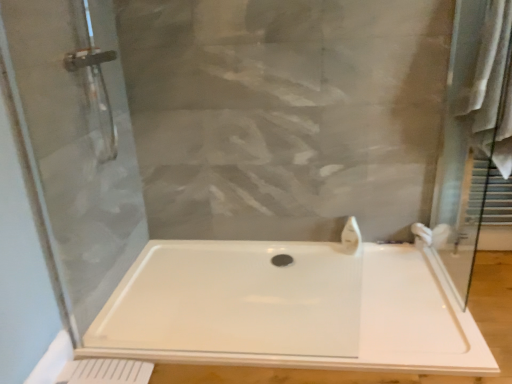
Find the location of `white plastic bathtub at center`. white plastic bathtub at center is located at coordinates (289, 309).

Identify the location of white plastic bathtub at center. (289, 309).

Does point (328, 270) come behind point (497, 142)?

Yes.

Which object is further away from the camera taking this photo, white plastic bathtub at center or white fabric bath towel at right?

white fabric bath towel at right is behind.

How different are the orientations of white plastic bathtub at center and white fabric bath towel at right in degrees?

176 degrees separate the facing orientations of white plastic bathtub at center and white fabric bath towel at right.

From a real-world perspective, who is located higher, white plastic bathtub at center or white fabric bath towel at right?

In real-world perspective, white fabric bath towel at right is above.

From a real-world perspective, is white glossy faucet at upper right under white plastic bathtub at center?

Actually, white glossy faucet at upper right is physically above white plastic bathtub at center in the real world.

Does point (356, 226) come closer to viewer compared to point (329, 317)?

No, it is behind (329, 317).

In the image, is white glossy faucet at upper right positioned in front of or behind white plastic bathtub at center?

Clearly, white glossy faucet at upper right is behind white plastic bathtub at center.

Considering the sizes of white glossy faucet at upper right and white plastic bathtub at center in the image, is white glossy faucet at upper right wider or thinner than white plastic bathtub at center?

In the image, white glossy faucet at upper right appears to be more narrow than white plastic bathtub at center.

Is white plastic bathtub at center far from white glossy faucet at upper right?

No, white plastic bathtub at center is not far away from white glossy faucet at upper right.

What's the angular difference between white plastic bathtub at center and white glossy faucet at upper right's facing directions?

They differ by 159 degrees in their facing directions.

From the image's perspective, is white plastic bathtub at center on top of white glossy faucet at upper right?

No, from the image's perspective, white plastic bathtub at center is not over white glossy faucet at upper right.

Is white plastic bathtub at center spatially inside white glossy faucet at upper right, or outside of it?

white plastic bathtub at center lies outside white glossy faucet at upper right.

Looking at their sizes, would you say white fabric bath towel at right is wider or thinner than white glossy faucet at upper right?

Clearly, white fabric bath towel at right has more width compared to white glossy faucet at upper right.

Can you confirm if white fabric bath towel at right is positioned to the left of white glossy faucet at upper right?

In fact, white fabric bath towel at right is to the right of white glossy faucet at upper right.

From the image's perspective, between white fabric bath towel at right and white glossy faucet at upper right, who is located below?

white glossy faucet at upper right appears lower in the image.

From the picture: From a real-world perspective, is white fabric bath towel at right above or below white glossy faucet at upper right?

From a real-world perspective, white fabric bath towel at right is physically above white glossy faucet at upper right.

The height and width of the screenshot is (384, 512). I want to click on bath towel in front of the white glossy faucet at upper right, so click(490, 89).

Consider the image. Is white glossy faucet at upper right facing towards white fabric bath towel at right?

No, white glossy faucet at upper right is not facing towards white fabric bath towel at right.

Can you confirm if white glossy faucet at upper right is wider than white fabric bath towel at right?

In fact, white glossy faucet at upper right might be narrower than white fabric bath towel at right.

Is white fabric bath towel at right placed right next to white plastic bathtub at center?

There is a gap between white fabric bath towel at right and white plastic bathtub at center.

Is point (492, 125) behind point (249, 258)?

No, (492, 125) is in front of (249, 258).

Is white plastic bathtub at center surrounded by white fabric bath towel at right?

No, white plastic bathtub at center is not surrounded by white fabric bath towel at right.

Image resolution: width=512 pixels, height=384 pixels. I want to click on bath towel above the white plastic bathtub at center (from a real-world perspective), so click(x=490, y=89).

At what (x,y) coordinates should I click in order to perform the action: click on bathtub that appears in front of the white glossy faucet at upper right. Please return your answer as a coordinate pair (x, y). This screenshot has height=384, width=512. Looking at the image, I should click on (289, 309).

Looking at the image, which one is located further to white plastic bathtub at center, white fabric bath towel at right or white glossy faucet at upper right?

white fabric bath towel at right is positioned further to the anchor white plastic bathtub at center.

From the image, which object appears to be nearer to white plastic bathtub at center, white glossy faucet at upper right or white fabric bath towel at right?

white glossy faucet at upper right is positioned closer to the anchor white plastic bathtub at center.

From the image, which object appears to be nearer to white fabric bath towel at right, white plastic bathtub at center or white glossy faucet at upper right?

white glossy faucet at upper right lies closer to white fabric bath towel at right than the other object.

From the image, which object appears to be nearer to white fabric bath towel at right, white glossy faucet at upper right or white plastic bathtub at center?

Among the two, white glossy faucet at upper right is located nearer to white fabric bath towel at right.

Looking at the image, which one is located further to white glossy faucet at upper right, white plastic bathtub at center or white fabric bath towel at right?

white fabric bath towel at right lies further to white glossy faucet at upper right than the other object.

Considering their positions, is white fabric bath towel at right positioned closer to white glossy faucet at upper right than white plastic bathtub at center?

Based on the image, white plastic bathtub at center appears to be nearer to white glossy faucet at upper right.

You are a GUI agent. You are given a task and a screenshot of the screen. Output one action in this format:
    pyautogui.click(x=<x>, y=<y>)
    Task: Click on the faucet that lies between white fabric bath towel at right and white plastic bathtub at center from top to bottom
    
    Given the screenshot: What is the action you would take?
    pyautogui.click(x=350, y=237)